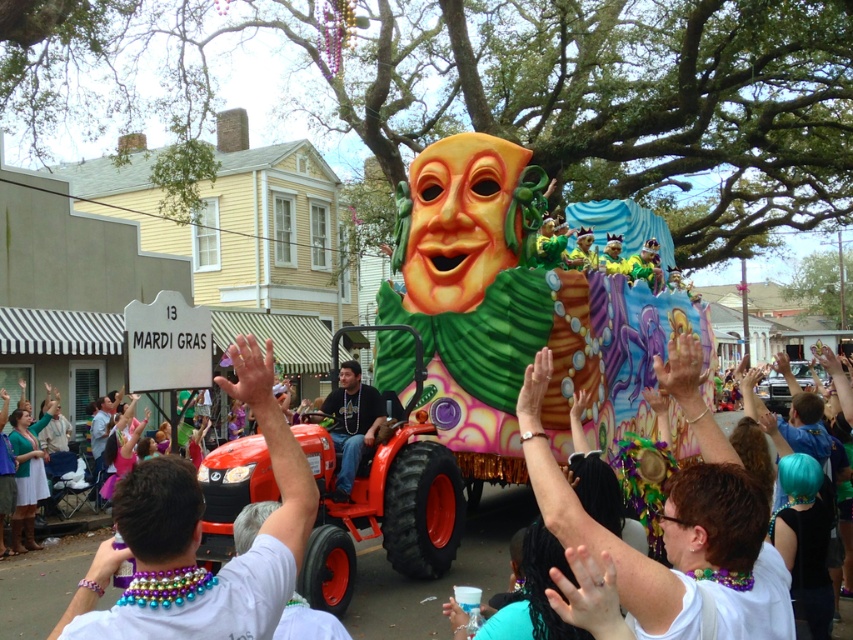
Can you confirm if shiny plastic mask at center is thinner than matte black shirt at center?

No.

Is shiny plastic mask at center closer to the viewer compared to matte black shirt at center?

That is True.

Does point (381, 340) lie behind point (351, 374)?

That is True.

Where is `shiny plastic mask at center`? shiny plastic mask at center is located at coordinates (485, 358).

Is the position of shiny plastic mask at center more distant than that of white beaded necklace at center?

Yes, shiny plastic mask at center is further from the viewer.

Describe the element at coordinates (485, 358) in the screenshot. This screenshot has height=640, width=853. I see `shiny plastic mask at center` at that location.

Where is `shiny plastic mask at center`? The image size is (853, 640). shiny plastic mask at center is located at coordinates (485, 358).

Is white beaded necklace at center in front of matte black shirt at center?

Yes.

Between point (134, 616) and point (346, 380), which one is positioned in front?

Point (134, 616)

Image resolution: width=853 pixels, height=640 pixels. In order to click on white beaded necklace at center in this screenshot , I will do `click(199, 540)`.